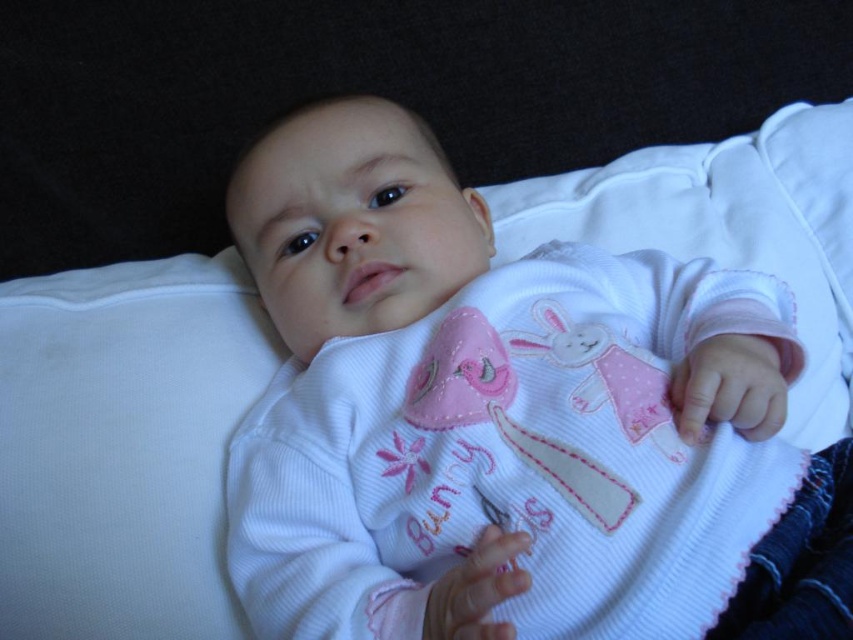
From the picture: You are a photographer setting up a shoot with a baby. The baby is wearing a white corduroy onesie at center and lying on a white soft pillow at upper left. To ensure the baby stays in place, you need to know if the onesie is covering the pillow. Can you confirm?

The white corduroy onesie at center is positioned over the white soft pillow at upper left, so yes, the onesie is covering the pillow.

You are holding a small stuffed animal that is 12 inches tall. You want to place it near the point marked at coordinate point (323, 348) so that it can be seen clearly by someone standing where you are. Is the distance sufficient for the stuffed animal to be placed there without being too close?

The point marked at coordinate point (323, 348) is 29.06 inches away from the viewer. Since the stuffed animal is 12 inches tall, placing it at this distance will allow it to be seen clearly without being too close.